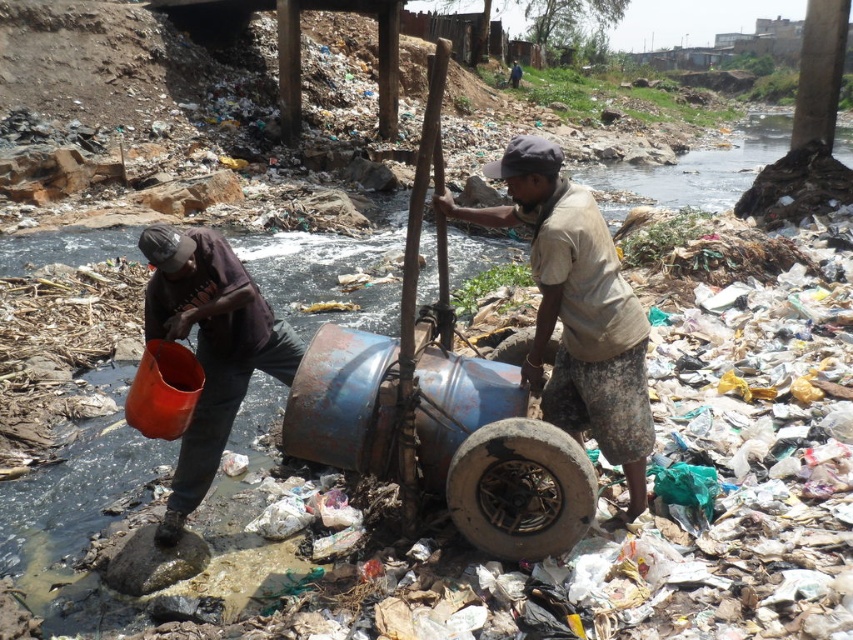
Question: Which point is farther to the camera?

Choices:
 (A) camouflage shorts at center
 (B) charred rubber tire at lower center

Answer: (A)

Question: Among these objects, which one is farthest from the camera?

Choices:
 (A) matte orange bucket at left
 (B) charred rubber tire at lower center
 (C) camouflage shorts at center

Answer: (A)

Question: Which object is farther from the camera taking this photo?

Choices:
 (A) matte orange bucket at left
 (B) camouflage shorts at center

Answer: (A)

Question: Does matte orange bucket at left appear under charred rubber tire at lower center?

Choices:
 (A) no
 (B) yes

Answer: (A)

Question: Is camouflage shorts at center bigger than charred rubber tire at lower center?

Choices:
 (A) no
 (B) yes

Answer: (B)

Question: Can you confirm if camouflage shorts at center is positioned above charred rubber tire at lower center?

Choices:
 (A) yes
 (B) no

Answer: (A)